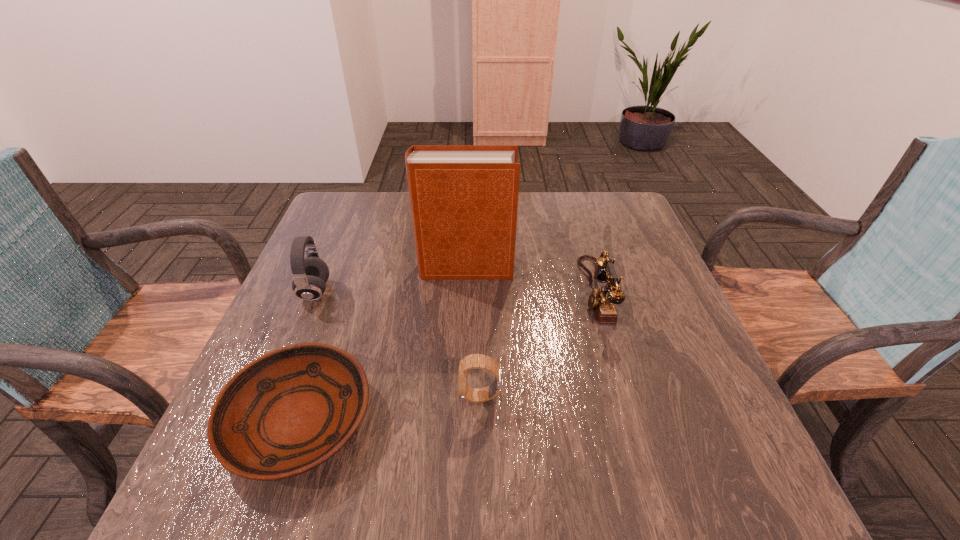
Locate an element on the screen. This screenshot has height=540, width=960. free location located on the face of the second shortest object is located at coordinates (392, 396).

Where is `free space located 0.110m on the face of the second shortest object`? The width and height of the screenshot is (960, 540). free space located 0.110m on the face of the second shortest object is located at coordinates (402, 396).

Find the location of a particular element. vacant space located on the face of the second shortest object is located at coordinates click(264, 396).

I want to click on free point located on the back of the plate, so click(x=352, y=267).

The width and height of the screenshot is (960, 540). Identify the location of object situated at the near edge. (285, 413).

You are a GUI agent. You are given a task and a screenshot of the screen. Output one action in this format:
    pyautogui.click(x=<x>, y=<y>)
    Task: Click on the headset located at the left edge
    The height and width of the screenshot is (540, 960).
    Given the screenshot: What is the action you would take?
    pyautogui.click(x=310, y=274)

This screenshot has height=540, width=960. Identify the location of plate that is at the left edge. (285, 413).

Locate an element on the screen. The height and width of the screenshot is (540, 960). object located in the right edge section of the desktop is located at coordinates (602, 301).

Find the location of a particular element. This screenshot has width=960, height=540. object that is at the near left corner is located at coordinates (285, 413).

Locate an element on the screen. This screenshot has width=960, height=540. vacant area at the far edge is located at coordinates (560, 198).